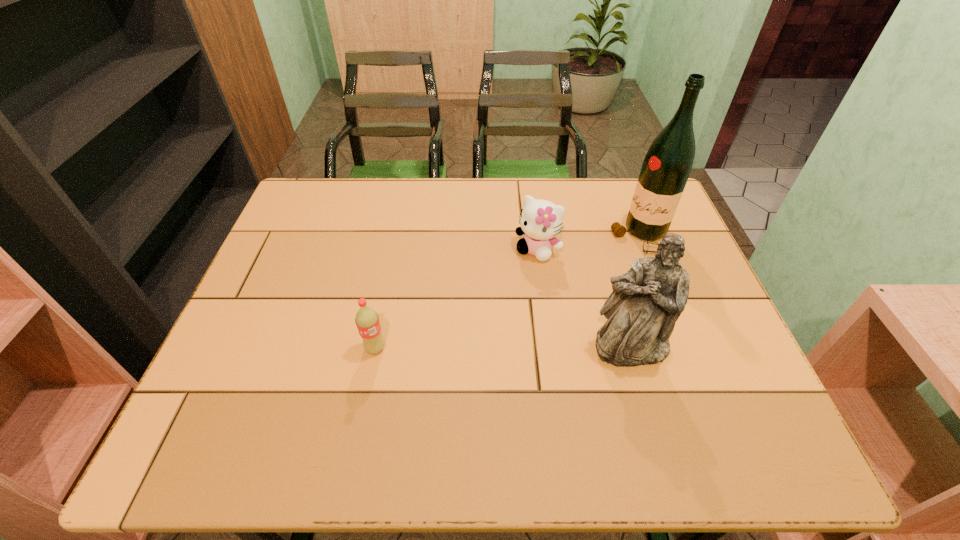
Find the location of a particular element. free spot at the near left corner of the desktop is located at coordinates (218, 387).

In order to click on vacant region at the near right corner of the desktop in this screenshot , I will do `click(729, 408)`.

Find the location of a particular element. free space between the wine bottle and the third object from right to left is located at coordinates (589, 243).

Find the location of a particular element. The height and width of the screenshot is (540, 960). vacant space that's between the kitten and the third shortest object is located at coordinates (585, 298).

This screenshot has width=960, height=540. What are the coordinates of `free space between the tallest object and the kitten` in the screenshot? It's located at (589, 243).

The height and width of the screenshot is (540, 960). In order to click on empty location between the leftmost object and the tallest object in this screenshot , I will do `click(508, 293)`.

Locate an element on the screen. This screenshot has width=960, height=540. vacant area that lies between the tallest object and the kitten is located at coordinates (589, 243).

The width and height of the screenshot is (960, 540). What are the coordinates of `free space between the soda and the second object from left to right` in the screenshot? It's located at (457, 299).

In order to click on vacant point located between the wine bottle and the leftmost object in this screenshot , I will do `click(508, 293)`.

Locate an element on the screen. empty space between the soda and the kitten is located at coordinates [x=457, y=299].